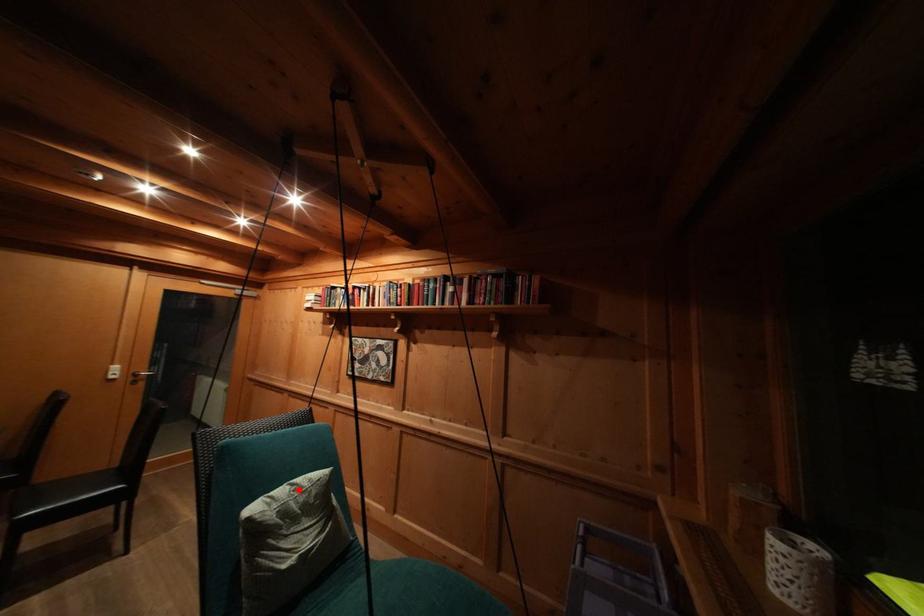
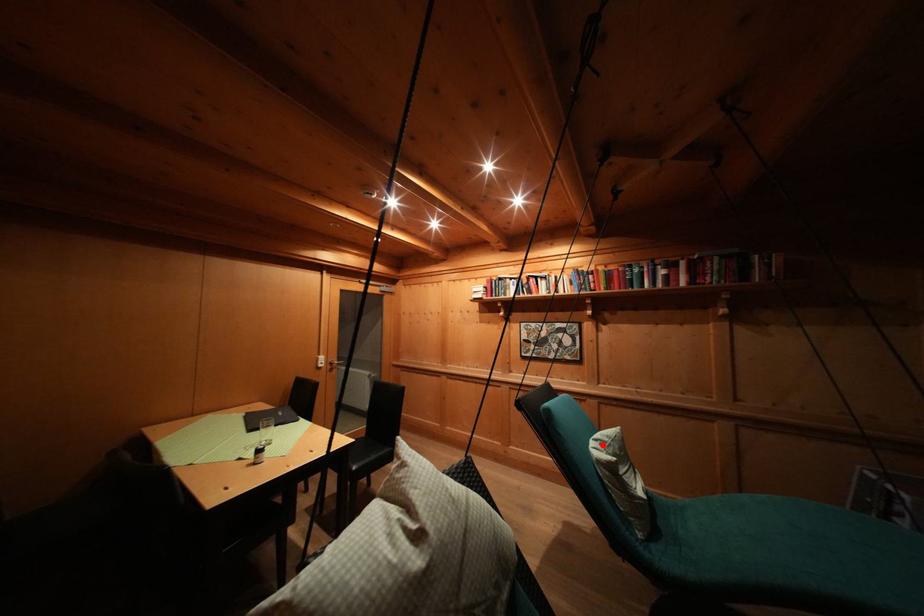
I am providing you with two images of the same scene from different viewpoints. A red point is marked on the first image and another point is marked on the second image. Are the points marked in image1 and image2 representing the same 3D position?

Yes